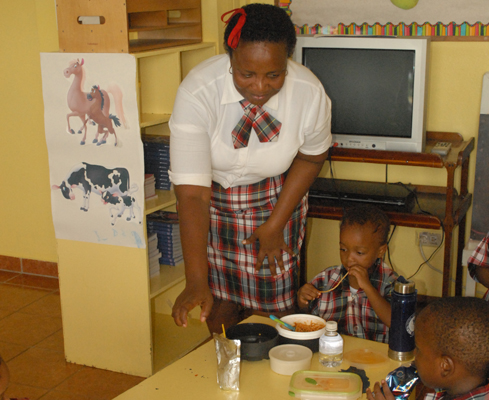
Where is `classroom`? The width and height of the screenshot is (489, 400). classroom is located at coordinates (45, 240), (397, 145), (448, 303), (80, 366).